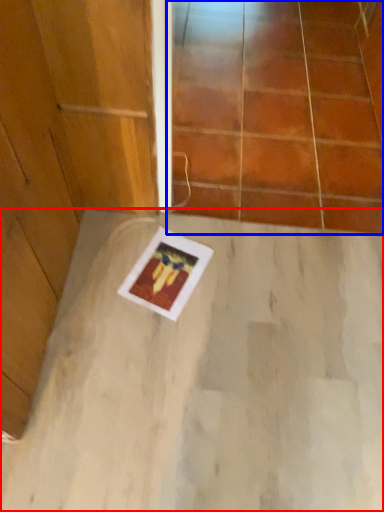
Question: Which object is further to the camera taking this photo, concrete (highlighted by a red box) or glass door (highlighted by a blue box)?

Choices:
 (A) concrete
 (B) glass door

Answer: (B)